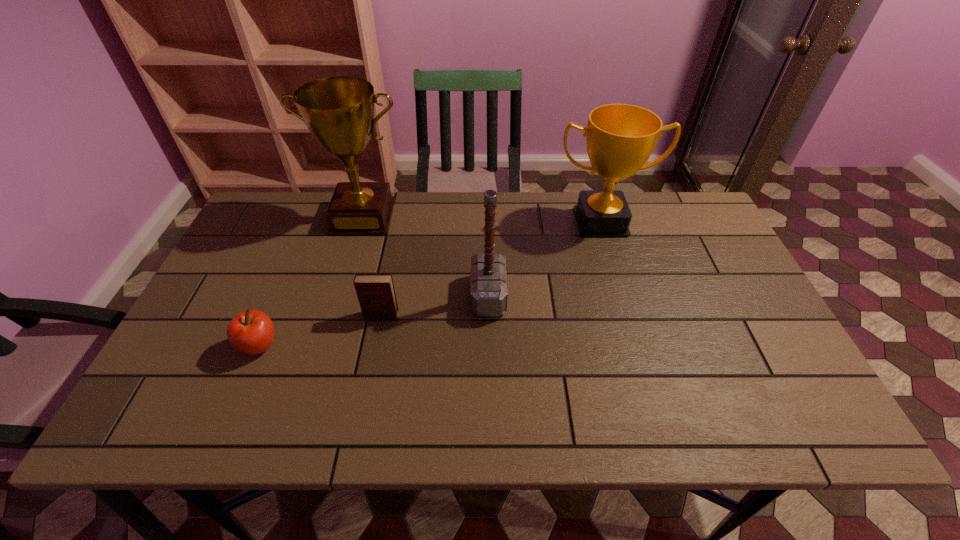
Image resolution: width=960 pixels, height=540 pixels. What are the coordinates of `vacant region located on the striking surface of the fourth object from left to right` in the screenshot? It's located at (373, 296).

Identify the location of free point located on the striking surface of the fourth object from left to right. The image size is (960, 540). (324, 296).

I want to click on vacant area located on the front cover of the diary, so click(365, 394).

This screenshot has height=540, width=960. What are the coordinates of `vacant space located 0.120m on the right of the apple` in the screenshot? It's located at (330, 347).

Locate an element on the screen. The width and height of the screenshot is (960, 540). object present at the left edge is located at coordinates (252, 332).

The width and height of the screenshot is (960, 540). Find the location of `vacant space at the far edge`. vacant space at the far edge is located at coordinates (401, 235).

Image resolution: width=960 pixels, height=540 pixels. In the image, there is a desktop. Identify the location of free space at the near edge. (681, 423).

Where is `free space at the left edge of the desktop`? free space at the left edge of the desktop is located at coordinates (223, 341).

At what (x,y) coordinates should I click in order to perform the action: click on vacant space at the right edge. Please return your answer as a coordinate pair (x, y). Looking at the image, I should click on (741, 282).

The height and width of the screenshot is (540, 960). In the image, there is a desktop. Find the location of `free space at the far left corner`. free space at the far left corner is located at coordinates (264, 221).